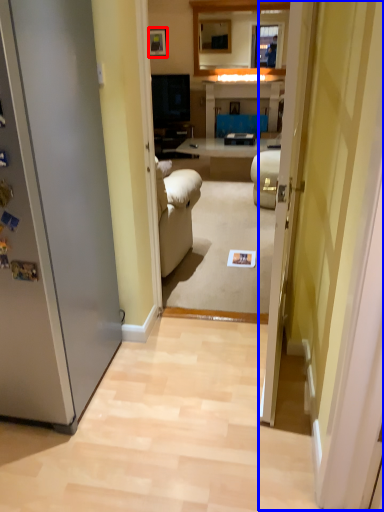
Question: Which of the following is the closest to the observer, picture frame (highlighted by a red box) or glass door (highlighted by a blue box)?

Choices:
 (A) picture frame
 (B) glass door

Answer: (B)